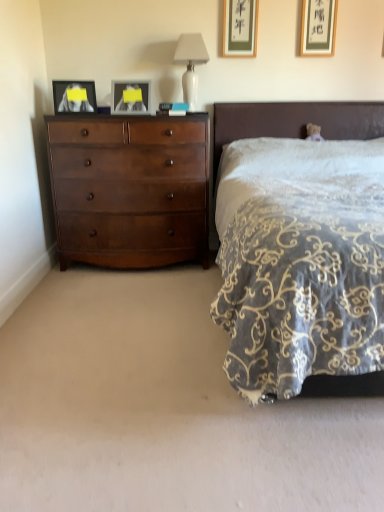
Locate an element on the screen. The width and height of the screenshot is (384, 512). matte gold picture frame at upper center, the third picture frame in the left-to-right sequence is located at coordinates (240, 28).

In order to face velvet dark brown bed at right, should I rotate leftwards or rightwards?

Rotate your view right by about 20.239°.

Describe the element at coordinates (294, 121) in the screenshot. This screenshot has width=384, height=512. I see `velvet dark brown bed at right` at that location.

This screenshot has height=512, width=384. What do you see at coordinates (130, 101) in the screenshot?
I see `matte glass picture frame at upper center, the third picture frame viewed from the right` at bounding box center [130, 101].

You are a GUI agent. You are given a task and a screenshot of the screen. Output one action in this format:
    pyautogui.click(x=<x>, y=<y>)
    Task: Click on the matte black picture frame at left, marked as the first picture frame in a left-to-right arrangement
    Image resolution: width=384 pixels, height=512 pixels.
    Given the screenshot: What is the action you would take?
    pyautogui.click(x=74, y=97)

You are a GUI agent. You are given a task and a screenshot of the screen. Output one action in this format:
    pyautogui.click(x=<x>, y=<y>)
    Task: Click on the shiny brown dresser at left
    The image size is (384, 512).
    Given the screenshot: What is the action you would take?
    pyautogui.click(x=130, y=190)

I want to click on matte gold picture frame at upper center, which is the 2th picture frame in right-to-left order, so click(240, 28).

Choose the correct answer: Is matte gold picture frame at upper right, which is the 4th picture frame in left-to-right order, inside shiny brown dresser at left or outside it?

matte gold picture frame at upper right, which is the 4th picture frame in left-to-right order, is located beyond the bounds of shiny brown dresser at left.

From the image's perspective, between matte gold picture frame at upper right, positioned as the first picture frame in right-to-left order, and shiny brown dresser at left, which one is located above?

matte gold picture frame at upper right, positioned as the first picture frame in right-to-left order, from the image's perspective.

This screenshot has width=384, height=512. In order to click on the chest of drawers below the matte gold picture frame at upper right, positioned as the first picture frame in right-to-left order (from the image's perspective) in this screenshot , I will do `click(130, 190)`.

Measure the distance from matte gold picture frame at upper center, the third picture frame in the left-to-right sequence, to matte gold picture frame at upper right, which is the 4th picture frame in left-to-right order.

A distance of 18.25 inches exists between matte gold picture frame at upper center, the third picture frame in the left-to-right sequence, and matte gold picture frame at upper right, which is the 4th picture frame in left-to-right order.

Could you tell me if matte gold picture frame at upper center, which is the 2th picture frame in right-to-left order, is turned towards matte gold picture frame at upper right, which is the 4th picture frame in left-to-right order?

No, matte gold picture frame at upper center, which is the 2th picture frame in right-to-left order, is not oriented towards matte gold picture frame at upper right, which is the 4th picture frame in left-to-right order.

From a real-world perspective, between matte gold picture frame at upper center, which is the 2th picture frame in right-to-left order, and matte gold picture frame at upper right, which is the 4th picture frame in left-to-right order, who is vertically lower?

matte gold picture frame at upper center, which is the 2th picture frame in right-to-left order, from a real-world perspective.

From the picture: Is matte gold picture frame at upper center, which is the 2th picture frame in right-to-left order, taller or shorter than matte gold picture frame at upper right, which is the 4th picture frame in left-to-right order?

Considering their sizes, matte gold picture frame at upper center, which is the 2th picture frame in right-to-left order, has more height than matte gold picture frame at upper right, which is the 4th picture frame in left-to-right order.

Does velvet dark brown bed at right turn towards matte black picture frame at left, marked as the first picture frame in a left-to-right arrangement?

No, velvet dark brown bed at right is not facing towards matte black picture frame at left, marked as the first picture frame in a left-to-right arrangement.

Locate an element on the screen. picture frame that is the 3rd object to the left of the velvet dark brown bed at right, starting at the anchor is located at coordinates (74, 97).

Is matte black picture frame at left, marked as the 4th picture frame in a right-to-left arrangement, a part of velvet dark brown bed at right?

No, matte black picture frame at left, marked as the 4th picture frame in a right-to-left arrangement, is not a part of velvet dark brown bed at right.

Is point (339, 123) positioned after point (94, 84)?

Yes, it is behind point (94, 84).

In the image, is matte black picture frame at left, marked as the 4th picture frame in a right-to-left arrangement, on the left side or the right side of matte gold picture frame at upper right, positioned as the first picture frame in right-to-left order?

Clearly, matte black picture frame at left, marked as the 4th picture frame in a right-to-left arrangement, is on the left of matte gold picture frame at upper right, positioned as the first picture frame in right-to-left order, in the image.

Considering the relative sizes of matte black picture frame at left, marked as the first picture frame in a left-to-right arrangement, and matte gold picture frame at upper right, positioned as the first picture frame in right-to-left order, in the image provided, is matte black picture frame at left, marked as the first picture frame in a left-to-right arrangement, shorter than matte gold picture frame at upper right, positioned as the first picture frame in right-to-left order,?

Yes.

Is matte black picture frame at left, marked as the 4th picture frame in a right-to-left arrangement, in contact with matte gold picture frame at upper right, which is the 4th picture frame in left-to-right order?

matte black picture frame at left, marked as the 4th picture frame in a right-to-left arrangement, and matte gold picture frame at upper right, which is the 4th picture frame in left-to-right order, are clearly separated.

From the matte black picture frame at left, marked as the first picture frame in a left-to-right arrangement, count 3rd picture frame to the right and point to it. Please provide its 2D coordinates.

[(318, 27)]

Is matte gold picture frame at upper right, which is the 4th picture frame in left-to-right order, bigger than matte black picture frame at left, marked as the first picture frame in a left-to-right arrangement?

Incorrect, matte gold picture frame at upper right, which is the 4th picture frame in left-to-right order, is not larger than matte black picture frame at left, marked as the first picture frame in a left-to-right arrangement.

Is matte gold picture frame at upper right, positioned as the first picture frame in right-to-left order, next to matte black picture frame at left, marked as the first picture frame in a left-to-right arrangement, and touching it?

They are not placed beside each other.

From a real-world perspective, which object rests below the other?

matte black picture frame at left, marked as the first picture frame in a left-to-right arrangement.

Is matte gold picture frame at upper right, positioned as the first picture frame in right-to-left order, looking in the opposite direction of matte black picture frame at left, marked as the 4th picture frame in a right-to-left arrangement?

No, matte gold picture frame at upper right, positioned as the first picture frame in right-to-left order,'s orientation is not away from matte black picture frame at left, marked as the 4th picture frame in a right-to-left arrangement.

Considering the positions of objects matte black picture frame at left, marked as the 4th picture frame in a right-to-left arrangement, and white ceramic table lamp at upper center in the image provided, who is more to the right, matte black picture frame at left, marked as the 4th picture frame in a right-to-left arrangement, or white ceramic table lamp at upper center?

Positioned to the right is white ceramic table lamp at upper center.

Does matte black picture frame at left, marked as the 4th picture frame in a right-to-left arrangement, have a lesser height compared to white ceramic table lamp at upper center?

Yes.

Between matte black picture frame at left, marked as the 4th picture frame in a right-to-left arrangement, and white ceramic table lamp at upper center, which one is positioned behind?

white ceramic table lamp at upper center is further away from the camera.

Considering the points (71, 91) and (183, 44), which point is in front, point (71, 91) or point (183, 44)?

Point (71, 91)

Is point (130, 111) in front of point (321, 18)?

Yes, it is in front of point (321, 18).

Consider the image. From a real-world perspective, which object stands above the other?

matte gold picture frame at upper right, positioned as the first picture frame in right-to-left order, is physically above.

From a real-world perspective, which picture frame is the 2nd one above the matte glass picture frame at upper center, marked as the 2th picture frame in a left-to-right arrangement? Please provide its 2D coordinates.

[(318, 27)]

Would you say matte gold picture frame at upper right, which is the 4th picture frame in left-to-right order, is part of matte glass picture frame at upper center, marked as the 2th picture frame in a left-to-right arrangement,'s contents?

No, matte gold picture frame at upper right, which is the 4th picture frame in left-to-right order, is not inside matte glass picture frame at upper center, marked as the 2th picture frame in a left-to-right arrangement.

Starting from the shiny brown dresser at left, which picture frame is the 4th one behind? Please provide its 2D coordinates.

[(318, 27)]

This screenshot has width=384, height=512. Identify the location of the 1st picture frame in front of the matte gold picture frame at upper right, which is the 4th picture frame in left-to-right order, starting your count from the anchor. (240, 28).

Estimate the real-world distances between objects in this image. Which object is closer to white ceramic table lamp at upper center, shiny brown dresser at left or matte glass picture frame at upper center, marked as the 2th picture frame in a left-to-right arrangement?

matte glass picture frame at upper center, marked as the 2th picture frame in a left-to-right arrangement.

Which object lies nearer to the anchor point shiny brown dresser at left, matte glass picture frame at upper center, marked as the 2th picture frame in a left-to-right arrangement, or velvet dark brown bed at right?

matte glass picture frame at upper center, marked as the 2th picture frame in a left-to-right arrangement, lies closer to shiny brown dresser at left than the other object.

Looking at the image, which one is located closer to white ceramic table lamp at upper center, shiny brown dresser at left or matte gold picture frame at upper right, which is the 4th picture frame in left-to-right order?

The object closer to white ceramic table lamp at upper center is matte gold picture frame at upper right, which is the 4th picture frame in left-to-right order.

Looking at this image, from the image, which object appears to be nearer to matte gold picture frame at upper center, which is the 2th picture frame in right-to-left order, matte black picture frame at left, marked as the first picture frame in a left-to-right arrangement, or matte glass picture frame at upper center, marked as the 2th picture frame in a left-to-right arrangement?

Among the two, matte glass picture frame at upper center, marked as the 2th picture frame in a left-to-right arrangement, is located nearer to matte gold picture frame at upper center, which is the 2th picture frame in right-to-left order.

Estimate the real-world distances between objects in this image. Which object is closer to matte gold picture frame at upper center, the third picture frame in the left-to-right sequence, shiny brown dresser at left or matte glass picture frame at upper center, the third picture frame viewed from the right?

matte glass picture frame at upper center, the third picture frame viewed from the right, is closer to matte gold picture frame at upper center, the third picture frame in the left-to-right sequence.

Looking at the image, which one is located further to matte glass picture frame at upper center, the third picture frame viewed from the right, matte gold picture frame at upper right, which is the 4th picture frame in left-to-right order, or matte gold picture frame at upper center, the third picture frame in the left-to-right sequence?

Among the two, matte gold picture frame at upper right, which is the 4th picture frame in left-to-right order, is located further to matte glass picture frame at upper center, the third picture frame viewed from the right.

Estimate the real-world distances between objects in this image. Which object is closer to shiny brown dresser at left, white ceramic table lamp at upper center or matte glass picture frame at upper center, marked as the 2th picture frame in a left-to-right arrangement?

matte glass picture frame at upper center, marked as the 2th picture frame in a left-to-right arrangement, is closer to shiny brown dresser at left.

From the image, which object appears to be nearer to velvet dark brown bed at right, white ceramic table lamp at upper center or shiny brown dresser at left?

Among the two, white ceramic table lamp at upper center is located nearer to velvet dark brown bed at right.

Identify the location of the chest of drawers situated between matte black picture frame at left, marked as the first picture frame in a left-to-right arrangement, and matte gold picture frame at upper right, which is the 4th picture frame in left-to-right order, from left to right. This screenshot has height=512, width=384. (130, 190).

I want to click on table lamp between matte black picture frame at left, marked as the 4th picture frame in a right-to-left arrangement, and matte gold picture frame at upper center, which is the 2th picture frame in right-to-left order, in the horizontal direction, so click(x=190, y=65).

Find the location of `chest of drawers between velvet dark brown bed at right and white ceramic table lamp at upper center along the z-axis`. chest of drawers between velvet dark brown bed at right and white ceramic table lamp at upper center along the z-axis is located at coordinates (130, 190).

At what (x,y) coordinates should I click in order to perform the action: click on chest of drawers between velvet dark brown bed at right and matte black picture frame at left, marked as the 4th picture frame in a right-to-left arrangement, along the z-axis. Please return your answer as a coordinate pair (x, y). Looking at the image, I should click on (130, 190).